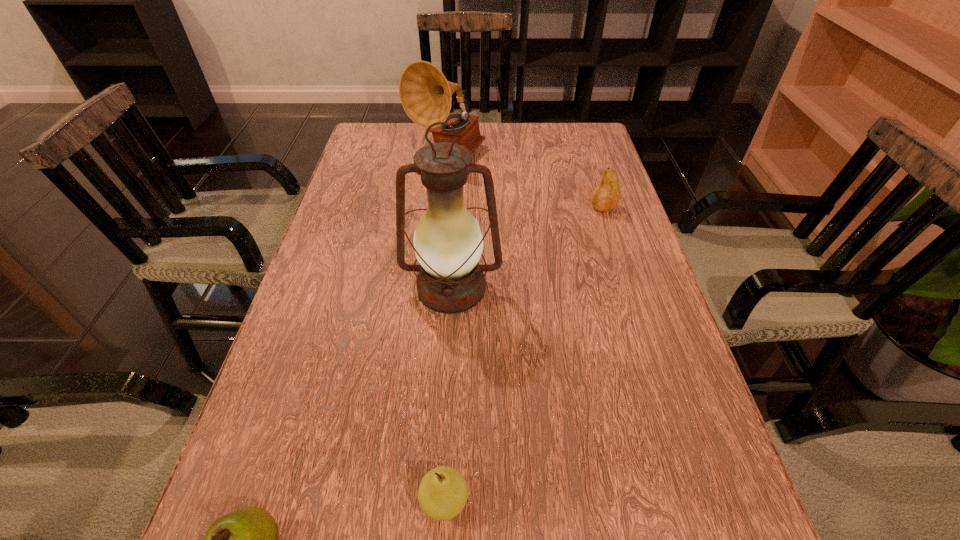
Where is `the third nearest object`? The image size is (960, 540). the third nearest object is located at coordinates (448, 243).

Image resolution: width=960 pixels, height=540 pixels. I want to click on oil lamp, so click(x=448, y=243).

Locate an element on the screen. This screenshot has height=540, width=960. the farthest object is located at coordinates click(425, 94).

Identify the location of phonograph record. (425, 94).

Locate an element on the screen. This screenshot has height=540, width=960. the farthest pear is located at coordinates (606, 195).

The height and width of the screenshot is (540, 960). What are the coordinates of `the rightmost pear` in the screenshot? It's located at (606, 195).

Where is `the shortest object`? This screenshot has height=540, width=960. the shortest object is located at coordinates (443, 492).

You are a GUI agent. You are given a task and a screenshot of the screen. Output one action in this format:
    pyautogui.click(x=<x>, y=<y>)
    Task: Click on the shortest pear
    The image size is (960, 540).
    Given the screenshot: What is the action you would take?
    pyautogui.click(x=443, y=492)

Locate an element on the screen. vacant space positioned 0.190m on the left of the third nearest object is located at coordinates (312, 288).

I want to click on free space located 0.160m on the horn of the second tallest object, so click(x=442, y=208).